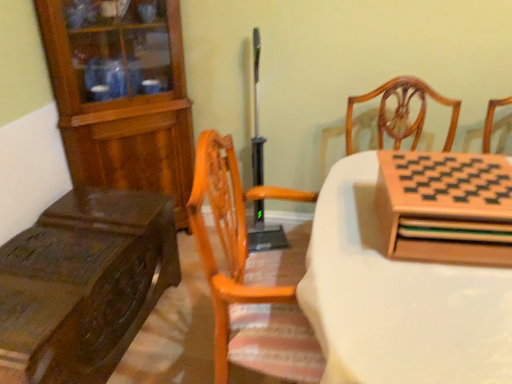
Question: From the image's perspective, is wooden chessboard at right, the first cabinetry from the right, on top of wooden chessboard at upper right, which appears as the second table when viewed from the left?

Choices:
 (A) yes
 (B) no

Answer: (A)

Question: From the image's perspective, is wooden chessboard at right, the second cabinetry in the back-to-front sequence, below wooden chessboard at upper right, which appears as the second table when viewed from the left?

Choices:
 (A) no
 (B) yes

Answer: (A)

Question: Is there a large distance between wooden chessboard at right, the second cabinetry when ordered from left to right, and wooden chessboard at upper right, which appears as the second table when viewed from the left?

Choices:
 (A) no
 (B) yes

Answer: (A)

Question: Is wooden chessboard at right, the second cabinetry when ordered from left to right, turned away from wooden chessboard at upper right, which appears as the 1th table when viewed from the right?

Choices:
 (A) yes
 (B) no

Answer: (B)

Question: From a real-world perspective, is wooden chessboard at right, the second cabinetry in the back-to-front sequence, positioned under wooden chessboard at upper right, which appears as the 1th table when viewed from the right, based on gravity?

Choices:
 (A) no
 (B) yes

Answer: (A)

Question: Based on their sizes in the image, would you say wooden chessboard at right, the 1th cabinetry in the front-to-back sequence, is bigger or smaller than dark brown wood table at left, the second table when ordered from right to left?

Choices:
 (A) small
 (B) big

Answer: (A)

Question: Would you say wooden chessboard at right, the second cabinetry when ordered from left to right, is to the left or to the right of dark brown wood table at left, the first table positioned from the left, in the picture?

Choices:
 (A) left
 (B) right

Answer: (B)

Question: Which is correct: wooden chessboard at right, the first cabinetry from the right, is inside dark brown wood table at left, the second table when ordered from right to left, or outside of it?

Choices:
 (A) inside
 (B) outside

Answer: (B)

Question: Is wooden chessboard at right, the first cabinetry from the right, wider or thinner than dark brown wood table at left, the first table positioned from the left?

Choices:
 (A) wide
 (B) thin

Answer: (B)

Question: Is wooden cabinet at left, which appears as the first cabinetry when viewed from the back, in front of or behind wooden chessboard at right, the second cabinetry in the back-to-front sequence, in the image?

Choices:
 (A) behind
 (B) front

Answer: (A)

Question: From the image's perspective, is wooden cabinet at left, marked as the second cabinetry in a right-to-left arrangement, located above or below wooden chessboard at right, the first cabinetry from the right?

Choices:
 (A) above
 (B) below

Answer: (A)

Question: In terms of width, does wooden cabinet at left, which appears as the first cabinetry when viewed from the back, look wider or thinner when compared to wooden chessboard at right, the second cabinetry when ordered from left to right?

Choices:
 (A) thin
 (B) wide

Answer: (A)

Question: Based on their sizes in the image, would you say wooden cabinet at left, which appears as the first cabinetry when viewed from the back, is bigger or smaller than wooden chessboard at right, the second cabinetry when ordered from left to right?

Choices:
 (A) small
 (B) big

Answer: (B)

Question: Relative to wooden cabinet at left, which ranks as the 2th cabinetry in front-to-back order, is dark brown wood table at left, the first table positioned from the left, in front or behind?

Choices:
 (A) behind
 (B) front

Answer: (B)

Question: In terms of height, does dark brown wood table at left, the second table when ordered from right to left, look taller or shorter compared to wooden cabinet at left, marked as the second cabinetry in a right-to-left arrangement?

Choices:
 (A) short
 (B) tall

Answer: (A)